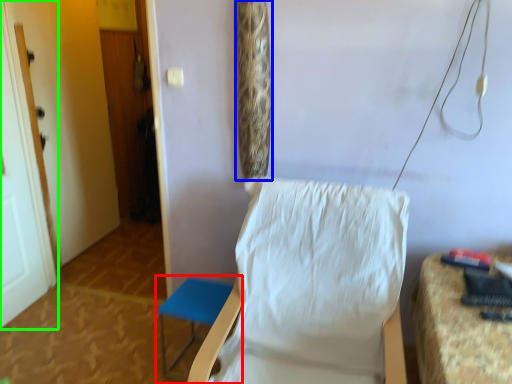
Question: Based on their relative distances, which object is farther from furniture (highlighted by a red box)? Choose from curtain (highlighted by a blue box) and door (highlighted by a green box).

Choices:
 (A) curtain
 (B) door

Answer: (B)